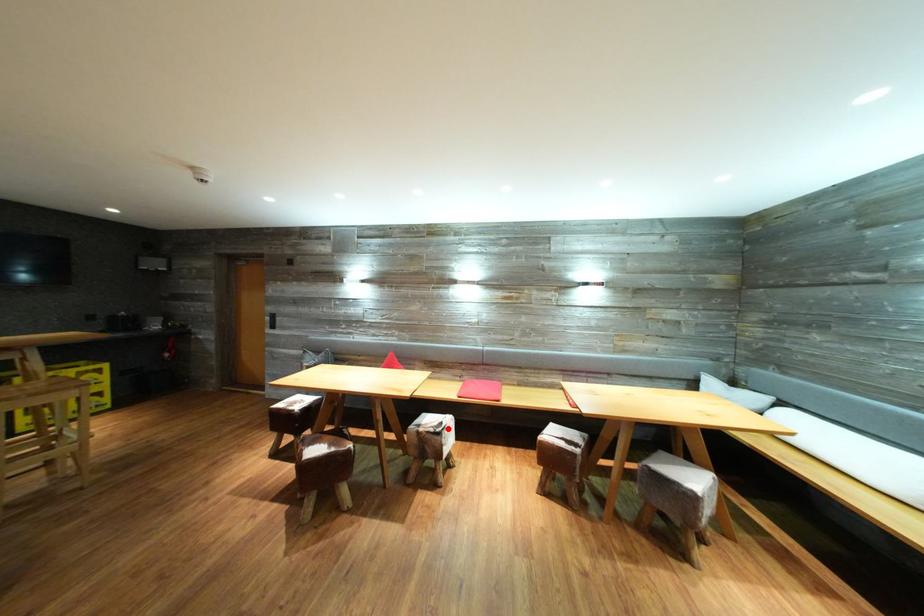
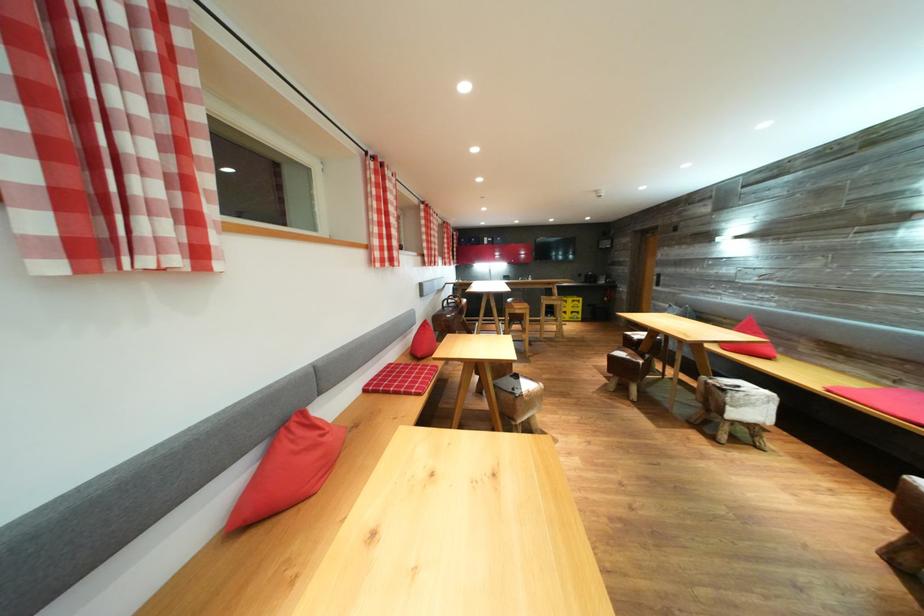
In the second image, find the point that corresponds to the highlighted location in the first image.

(745, 392)